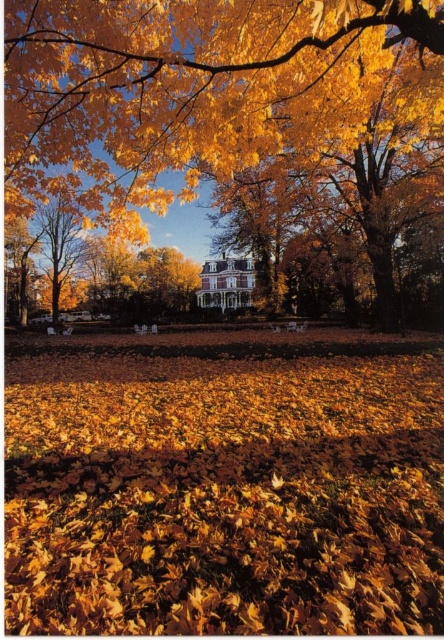
You are standing in the autumn scene and want to pick up leaves. Which leaves, the shiny golden leaves at center or the golden textured leaves at center, are easier to reach without moving your position?

The shiny golden leaves at center are closer to the viewer than the golden textured leaves at center, so they are easier to reach without moving your position.

You are an artist planning to paint the autumn scene. You want to highlight the contrast between the shiny golden leaves at center and the golden textured leaves at center. Which of these two leaves should you emphasize as being thinner?

The shiny golden leaves at center is thinner than the golden textured leaves at center, so you should emphasize the shiny golden leaves at center as the thinner one in your painting.

You are standing at the point marked as point (x=225, y=492) in the image. Looking around, you see shiny golden leaves at center. What is directly beneath your feet?

The point (x=225, y=492) is on shiny golden leaves at center, so the area directly beneath your feet is covered in shiny golden leaves at center.